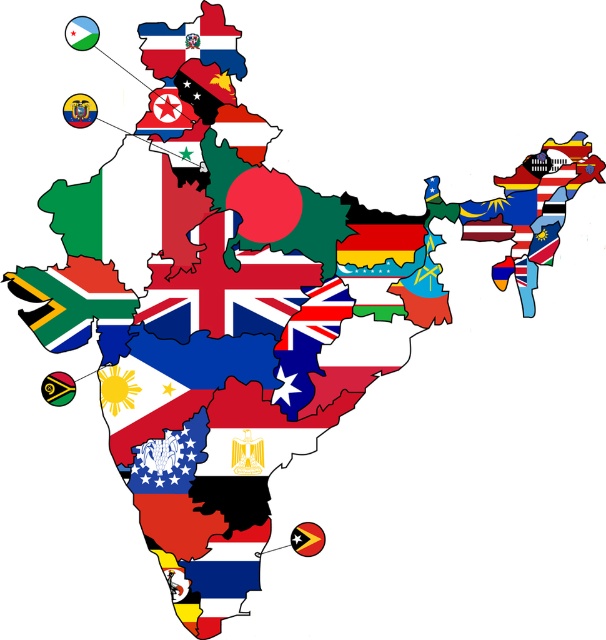
Question: Which point appears closest to the camera in this image?

Choices:
 (A) (119, 310)
 (B) (215, 22)

Answer: (B)

Question: Does blue and white striped flag at bottom left have a smaller size compared to matte red flag at upper center?

Choices:
 (A) yes
 (B) no

Answer: (B)

Question: Which of the following is the closest to the observer?

Choices:
 (A) matte red flag at upper center
 (B) blue and white striped flag at bottom left

Answer: (A)

Question: Is blue and white striped flag at bottom left below matte red flag at upper center?

Choices:
 (A) no
 (B) yes

Answer: (B)

Question: Can you confirm if blue and white striped flag at bottom left is positioned to the left of matte red flag at upper center?

Choices:
 (A) yes
 (B) no

Answer: (A)